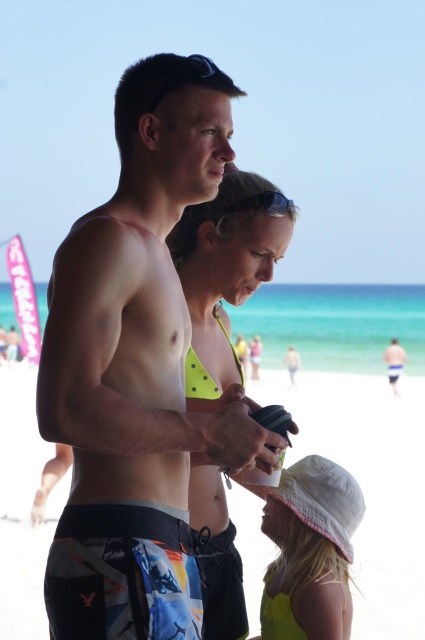
The width and height of the screenshot is (425, 640). What are the coordinates of `multicolored board shorts at center` in the screenshot? It's located at (136, 371).

Does point (189, 99) lie behind point (396, 392)?

No, (189, 99) is in front of (396, 392).

Locate an element on the screen. multicolored board shorts at center is located at coordinates (136, 371).

What do you see at coordinates (370, 483) in the screenshot? The image size is (425, 640). I see `white fabric hat at lower center` at bounding box center [370, 483].

Is the position of white fabric hat at lower center less distant than that of neon green bikini top at center?

That is False.

The width and height of the screenshot is (425, 640). Find the location of `white fabric hat at lower center`. white fabric hat at lower center is located at coordinates (370, 483).

Which of these two, neon green bikini top at center or white cotton hat at lower right, stands shorter?

With less height is white cotton hat at lower right.

Describe the element at coordinates (226, 272) in the screenshot. I see `neon green bikini top at center` at that location.

The image size is (425, 640). What do you see at coordinates (226, 272) in the screenshot?
I see `neon green bikini top at center` at bounding box center [226, 272].

Where is `neon green bikini top at center`? neon green bikini top at center is located at coordinates (226, 272).